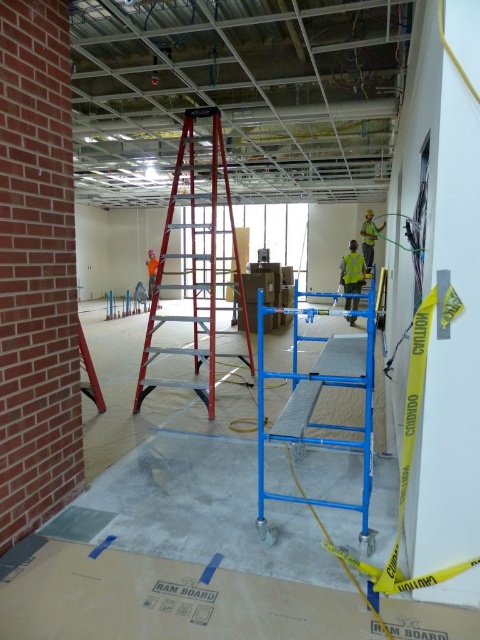
You are a construction worker standing at the entrance of the room. You need to reach a specific point marked at coordinates point (170,353) to install a light fixture. Given that your ladder can extend up to 4 meters, will it be sufficient to reach that point?

The distance of point (170,353) from camera is 4.46 meters, so the ladder that can extend up to 4 meters is not sufficient to reach the point as it is 0.46 meters too short.

You are an inspector checking safety equipment in the construction site. You see a high visibility yellow safety vest at center and a reflective yellow safety vest at right. Which one is bigger?

The high visibility yellow safety vest at center is larger in size than the reflective yellow safety vest at right.